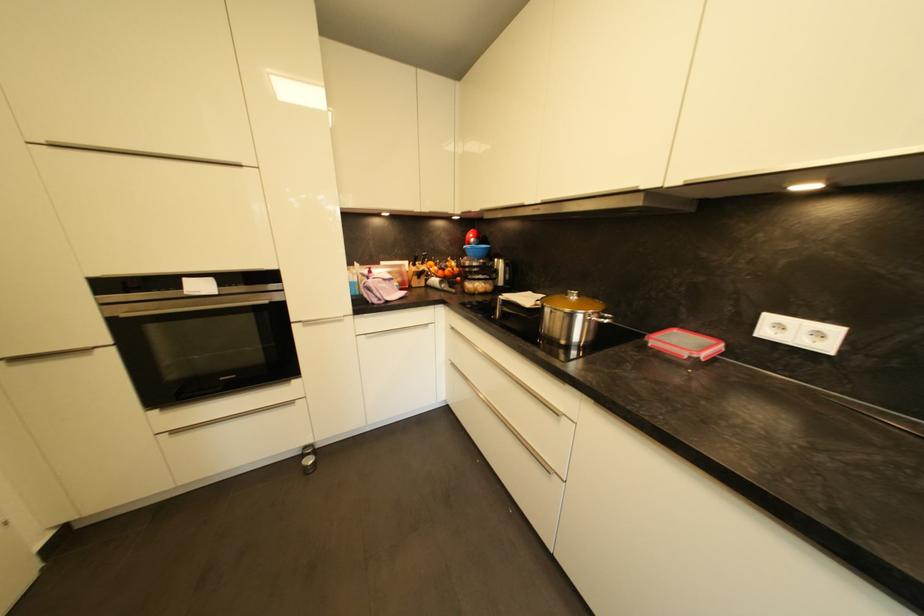
The height and width of the screenshot is (616, 924). I want to click on small metal cylinder, so click(309, 459).